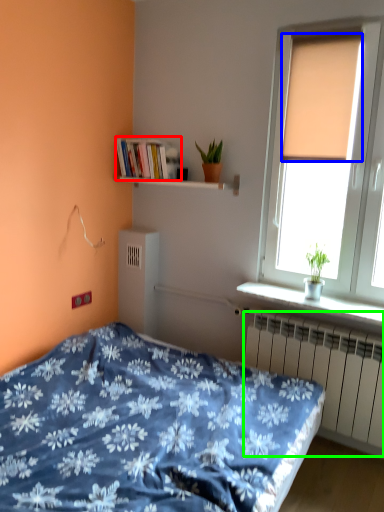
Question: Considering the real-world distances, which object is closest to book (highlighted by a red box)? curtain (highlighted by a blue box) or radiator (highlighted by a green box).

Choices:
 (A) curtain
 (B) radiator

Answer: (A)